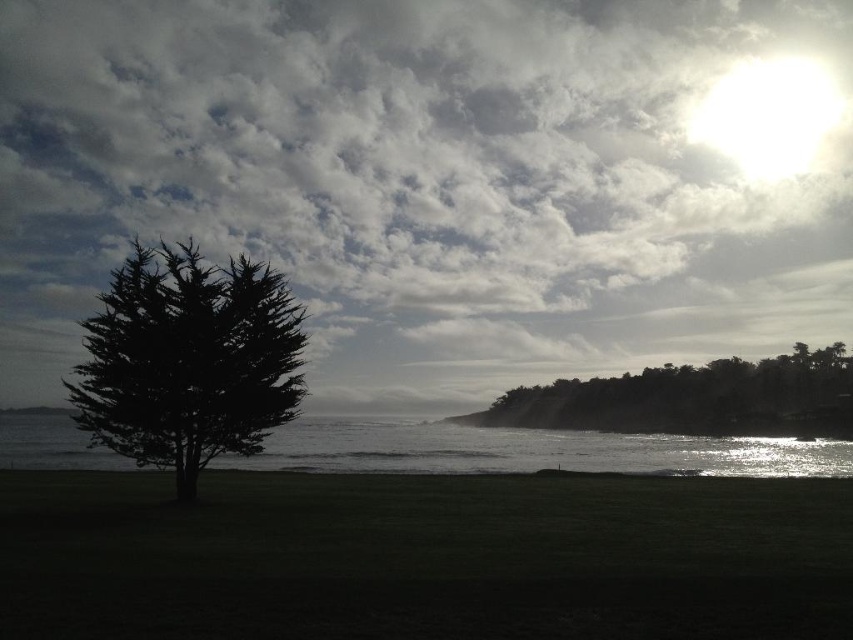
Question: Is glistening silver water at center positioned behind dark green textured trees at lower right?

Choices:
 (A) yes
 (B) no

Answer: (B)

Question: Considering the real-world distances, which object is closest to the glistening silver water at center?

Choices:
 (A) dark green textured trees at lower right
 (B) green grassy at center

Answer: (A)

Question: Is black matte tree at left above glistening silver water at center?

Choices:
 (A) no
 (B) yes

Answer: (B)

Question: Which point is closer to the camera taking this photo?

Choices:
 (A) (252, 321)
 (B) (672, 412)
 (C) (68, 104)
 (D) (399, 442)

Answer: (A)

Question: Is cloudy sky at upper center to the left of black matte tree at left from the viewer's perspective?

Choices:
 (A) yes
 (B) no

Answer: (B)

Question: Which of these objects is positioned farthest from the dark green textured trees at lower right?

Choices:
 (A) glistening silver water at center
 (B) green grassy at center

Answer: (B)